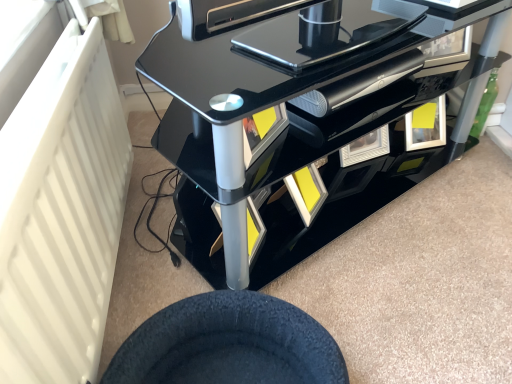
Where is `spots to the right of black fuzzy wheel at lower center`? The height and width of the screenshot is (384, 512). spots to the right of black fuzzy wheel at lower center is located at coordinates (380, 321).